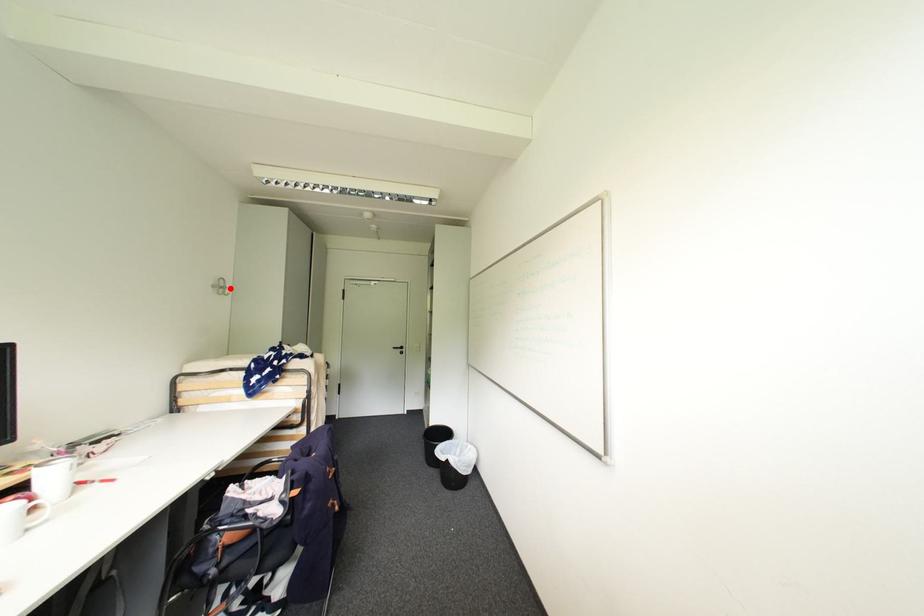
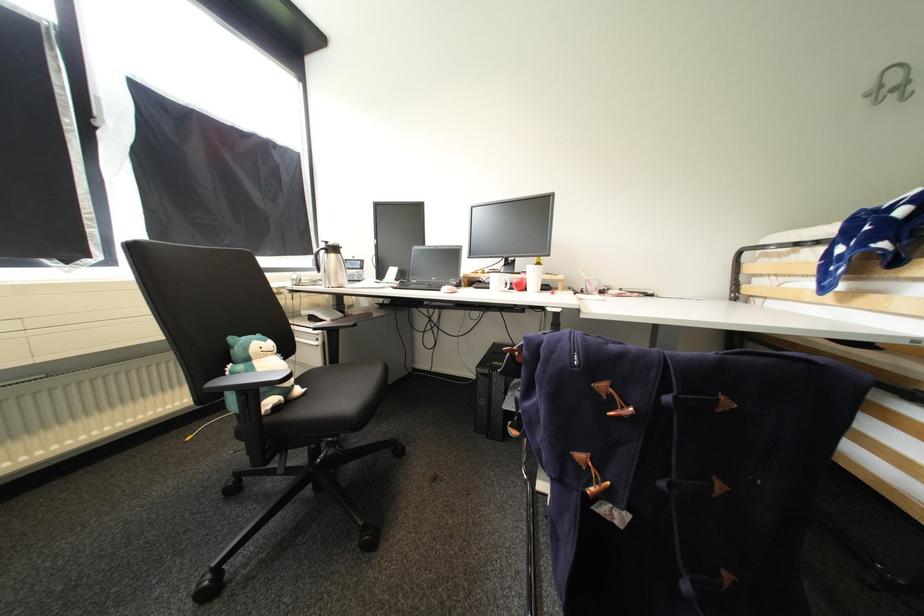
Locate, in the second image, the point that corresponds to the highlighted location in the first image.

(912, 84)